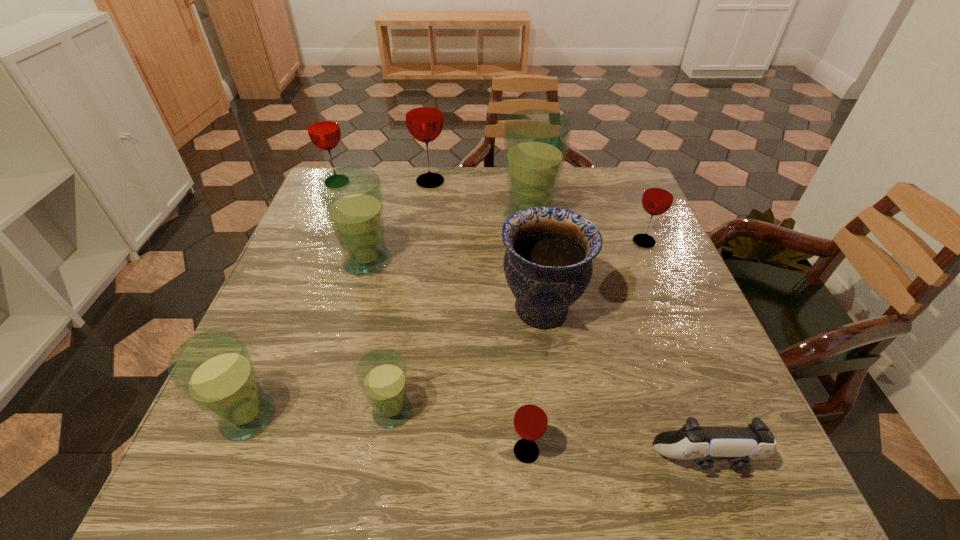
At what (x,y) coordinates should I click in order to perform the action: click on the second blue glass from right to left. Please return your answer as a coordinate pair (x, y). The width and height of the screenshot is (960, 540). Looking at the image, I should click on (382, 373).

Locate an element on the screen. Image resolution: width=960 pixels, height=540 pixels. the smallest red glass is located at coordinates (530, 421).

Locate an element on the screen. This screenshot has height=540, width=960. the nearest red glass is located at coordinates (530, 421).

Locate an element on the screen. the shortest object is located at coordinates (738, 445).

The height and width of the screenshot is (540, 960). Identify the location of free spot located 0.130m on the right of the third red glass from right to left. (491, 181).

At what (x,y) coordinates should I click in order to perform the action: click on vacant region located on the back of the farthest blue glass. Please return your answer as a coordinate pair (x, y). Looking at the image, I should click on (525, 187).

Find the location of a particular element. This screenshot has height=540, width=960. vacant space located on the right of the second biggest red glass is located at coordinates (378, 183).

Where is `vacant area located on the back of the third glass from left to right`? This screenshot has height=540, width=960. vacant area located on the back of the third glass from left to right is located at coordinates (392, 170).

Find the location of `vacant space located 0.080m on the front handle of the pottery`. vacant space located 0.080m on the front handle of the pottery is located at coordinates (462, 309).

Identify the location of vacant space positioned on the front handle of the pottery. This screenshot has width=960, height=540. (444, 309).